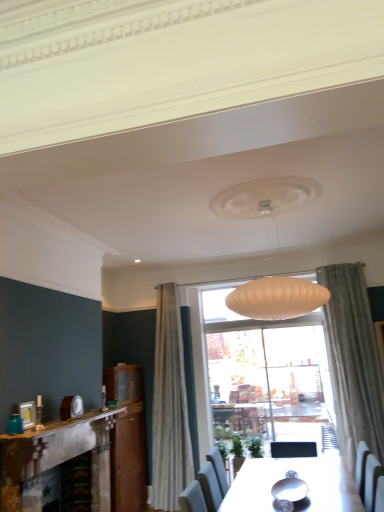
Find the location of a particular element. white marble fireplace at lower left is located at coordinates (63, 425).

In order to click on rustic stone fireplace at left in this screenshot , I will do `click(77, 464)`.

In order to click on teal glass jar at left in this screenshot , I will do `click(15, 424)`.

Identify the location of white marble fireplace at lower left. (63, 425).

Based on the photo, which point is more distant from viewer, (71, 451) or (3, 434)?

The point (71, 451) is more distant.

Which is in front, rustic stone fireplace at left or white marble fireplace at lower left?

rustic stone fireplace at left is closer to the camera.

Which of these two, rustic stone fireplace at left or white marble fireplace at lower left, stands shorter?

With less height is white marble fireplace at lower left.

Would you say rustic stone fireplace at left is a long distance from white marble fireplace at lower left?

Actually, rustic stone fireplace at left and white marble fireplace at lower left are a little close together.

Does point (18, 422) come in front of point (7, 437)?

No, it is behind (7, 437).

Which of these two, teal glass jar at left or white marble fireplace at lower left, is bigger?

white marble fireplace at lower left.

How many degrees apart are the facing directions of teal glass jar at left and white marble fireplace at lower left?

There is a 1.25-degree angle between the facing directions of teal glass jar at left and white marble fireplace at lower left.

Considering the relative positions of teal glass jar at left and white marble fireplace at lower left in the image provided, is teal glass jar at left in front of white marble fireplace at lower left?

No, it is not.

Considering the relative sizes of white marble fireplace at lower left and teal glass jar at left in the image provided, is white marble fireplace at lower left thinner than teal glass jar at left?

In fact, white marble fireplace at lower left might be wider than teal glass jar at left.

Is white marble fireplace at lower left directly adjacent to teal glass jar at left?

There is a gap between white marble fireplace at lower left and teal glass jar at left.

Identify the location of teal behind the white marble fireplace at lower left. The height and width of the screenshot is (512, 384). (15, 424).

Considering the points (24, 434) and (72, 467), which point is behind, point (24, 434) or point (72, 467)?

Positioned behind is point (72, 467).

Considering the relative sizes of white marble fireplace at lower left and rustic stone fireplace at left in the image provided, is white marble fireplace at lower left bigger than rustic stone fireplace at left?

Incorrect, white marble fireplace at lower left is not larger than rustic stone fireplace at left.

Considering the relative sizes of white marble fireplace at lower left and rustic stone fireplace at left in the image provided, is white marble fireplace at lower left shorter than rustic stone fireplace at left?

Yes, white marble fireplace at lower left is shorter than rustic stone fireplace at left.

Which object is further away from the camera taking this photo, white marble fireplace at lower left or rustic stone fireplace at left?

white marble fireplace at lower left is further away from the camera.

Could you tell me if teal glass jar at left is turned towards rustic stone fireplace at left?

No, teal glass jar at left is not aimed at rustic stone fireplace at left.

Visually, is teal glass jar at left positioned to the left or to the right of rustic stone fireplace at left?

teal glass jar at left is positioned on rustic stone fireplace at left's left side.

Is teal glass jar at left far away from rustic stone fireplace at left?

Indeed, teal glass jar at left is not near rustic stone fireplace at left.

The height and width of the screenshot is (512, 384). Find the location of `teal behind the rustic stone fireplace at left`. teal behind the rustic stone fireplace at left is located at coordinates (15, 424).

In the scene shown: From the image's perspective, is rustic stone fireplace at left located beneath teal glass jar at left?

Yes, from the image's perspective, rustic stone fireplace at left is below teal glass jar at left.

This screenshot has width=384, height=512. There is a rustic stone fireplace at left. Find the location of `teal above it (from a real-world perspective)`. teal above it (from a real-world perspective) is located at coordinates (15, 424).

From a real-world perspective, is rustic stone fireplace at left positioned under teal glass jar at left based on gravity?

Yes.

Would you say rustic stone fireplace at left is inside or outside teal glass jar at left?

rustic stone fireplace at left is not enclosed by teal glass jar at left.

This screenshot has height=512, width=384. What are the coordinates of `mantle above the rustic stone fireplace at left (from a real-world perspective)` in the screenshot? It's located at (63, 425).

This screenshot has width=384, height=512. What are the coordinates of `teal that appears above the white marble fireplace at lower left (from the image's perspective)` in the screenshot? It's located at (15, 424).

Considering their positions, is rustic stone fireplace at left positioned further to white marble fireplace at lower left than teal glass jar at left?

Based on the image, teal glass jar at left appears to be further to white marble fireplace at lower left.

Considering their positions, is teal glass jar at left positioned closer to rustic stone fireplace at left than white marble fireplace at lower left?

Based on the image, white marble fireplace at lower left appears to be nearer to rustic stone fireplace at left.

Which object lies nearer to the anchor point white marble fireplace at lower left, teal glass jar at left or rustic stone fireplace at left?

rustic stone fireplace at left.

Estimate the real-world distances between objects in this image. Which object is further from rustic stone fireplace at left, white marble fireplace at lower left or teal glass jar at left?

teal glass jar at left is positioned further to the anchor rustic stone fireplace at left.

Which object lies nearer to the anchor point teal glass jar at left, rustic stone fireplace at left or white marble fireplace at lower left?

Based on the image, white marble fireplace at lower left appears to be nearer to teal glass jar at left.

Considering their positions, is white marble fireplace at lower left positioned closer to teal glass jar at left than rustic stone fireplace at left?

white marble fireplace at lower left is closer to teal glass jar at left.

The height and width of the screenshot is (512, 384). Find the location of `mantle that lies between teal glass jar at left and rustic stone fireplace at left from top to bottom`. mantle that lies between teal glass jar at left and rustic stone fireplace at left from top to bottom is located at coordinates (63, 425).